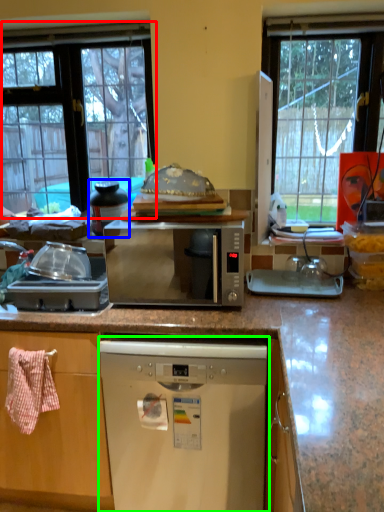
Question: Which is nearer to the window (highlighted by a red box)? appliance (highlighted by a blue box) or dishwasher (highlighted by a green box).

Choices:
 (A) appliance
 (B) dishwasher

Answer: (A)